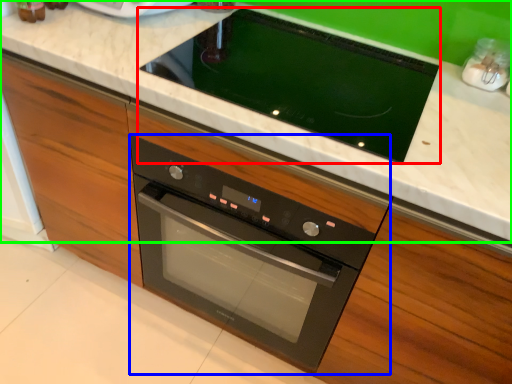
Question: Which is nearer to the home appliance (highlighted by a red box)? oven (highlighted by a blue box) or countertop (highlighted by a green box).

Choices:
 (A) oven
 (B) countertop

Answer: (B)